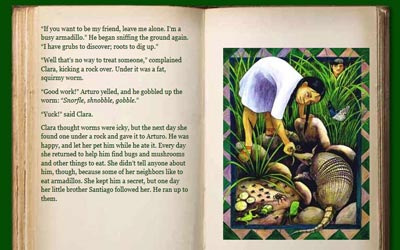
Find the location of a particular element. Image resolution: width=400 pixels, height=250 pixels. corner is located at coordinates (375, 9), (29, 244), (377, 246), (27, 7).